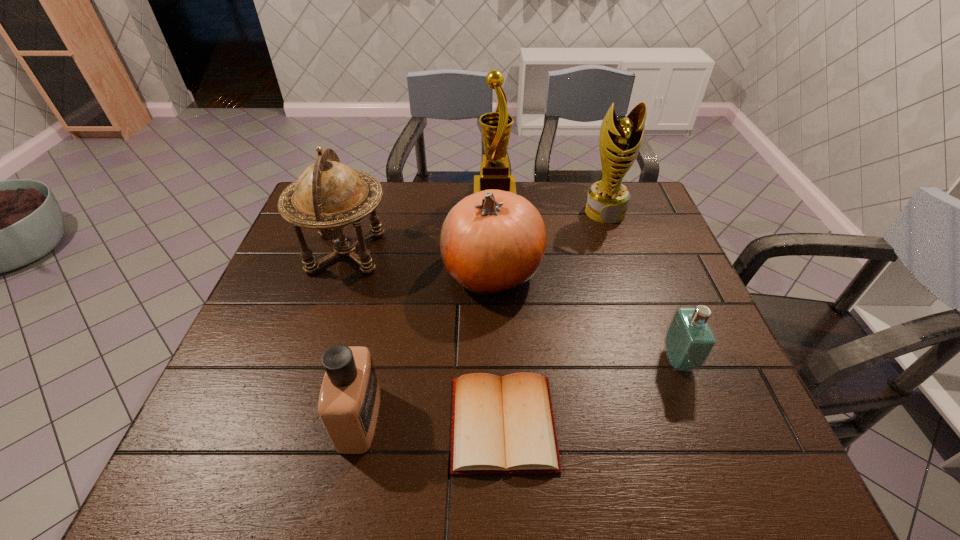
The width and height of the screenshot is (960, 540). What are the coordinates of `perfume located in the near edge section of the desktop` in the screenshot? It's located at (349, 399).

Identify the location of Bible that is at the near edge. (506, 425).

Where is `object at the left edge`? object at the left edge is located at coordinates (328, 195).

Locate an element on the screen. award at the right edge is located at coordinates (607, 200).

The width and height of the screenshot is (960, 540). I want to click on perfume positioned at the right edge, so 689,340.

Image resolution: width=960 pixels, height=540 pixels. Find the location of `object at the far right corner`. object at the far right corner is located at coordinates (607, 200).

This screenshot has width=960, height=540. In the image, there is a desktop. Find the location of `vacant space at the far edge`. vacant space at the far edge is located at coordinates click(x=448, y=201).

Identify the location of free space at the near edge of the desktop. The image size is (960, 540). (446, 448).

Image resolution: width=960 pixels, height=540 pixels. What are the coordinates of `free spot at the left edge of the desktop` in the screenshot? It's located at (270, 427).

Locate an element on the screen. This screenshot has width=960, height=540. vacant space at the right edge is located at coordinates (643, 318).